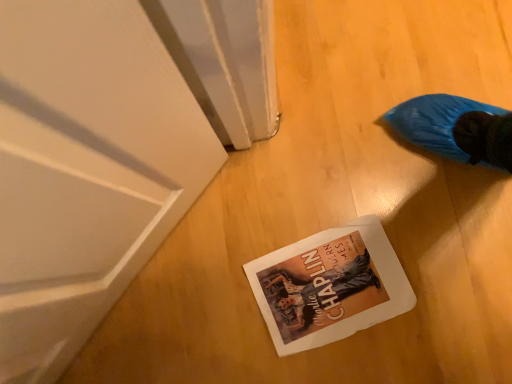
You are a GUI agent. You are given a task and a screenshot of the screen. Output one action in this format:
    pyautogui.click(x=<x>, y=<y>)
    Task: Click on the empty space that is ontop of white paper book at center
    Image resolution: width=512 pixels, height=384 pixels.
    Given the screenshot: What is the action you would take?
    330,286